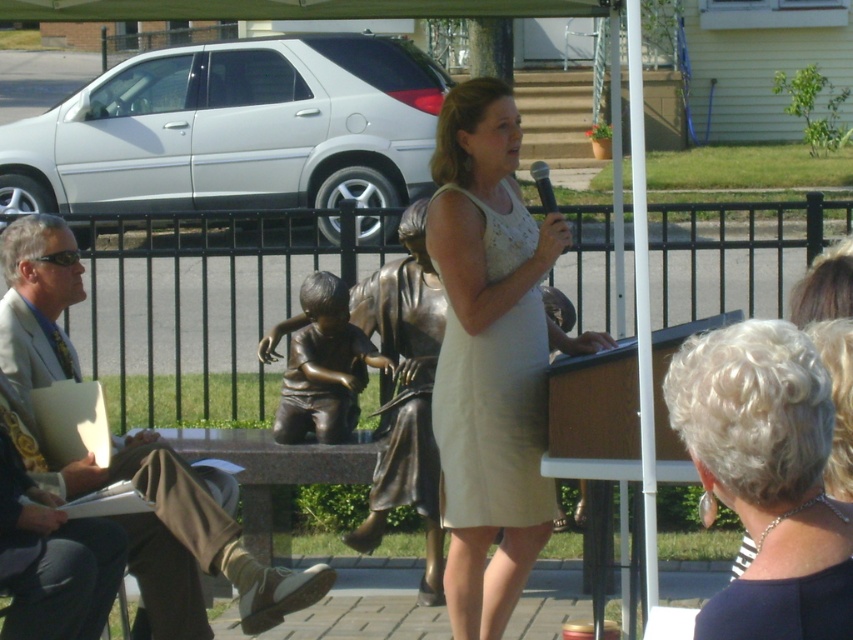
Question: Which point is closer to the camera taking this photo?

Choices:
 (A) (265, 596)
 (B) (345, 355)
 (C) (788, 490)
 (D) (494, 170)

Answer: (C)

Question: Which is nearer to the bronze statue at center?

Choices:
 (A) white satin dress at center
 (B) light brown suit at left
 (C) white textured hair at upper right

Answer: (B)

Question: Observing the image, what is the correct spatial positioning of white satin dress at center in reference to white textured hair at upper right?

Choices:
 (A) below
 (B) above

Answer: (B)

Question: Can you confirm if light brown suit at left is positioned to the right of bronze statue at center?

Choices:
 (A) no
 (B) yes

Answer: (A)

Question: Among these objects, which one is nearest to the camera?

Choices:
 (A) white satin dress at center
 (B) light brown suit at left

Answer: (A)

Question: Can you confirm if light brown suit at left is positioned below bronze statue at center?

Choices:
 (A) yes
 (B) no

Answer: (A)